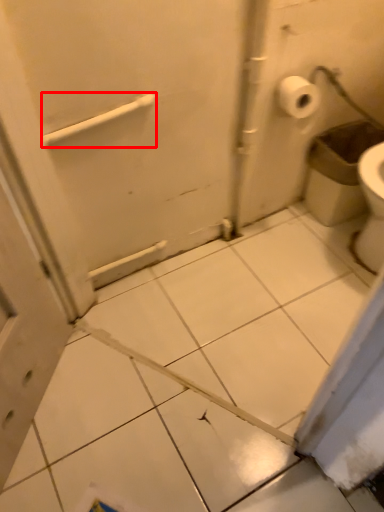
Question: From the image, what is the correct spatial relationship of towel bar (annotated by the red box) in relation to garbage?

Choices:
 (A) right
 (B) left

Answer: (B)